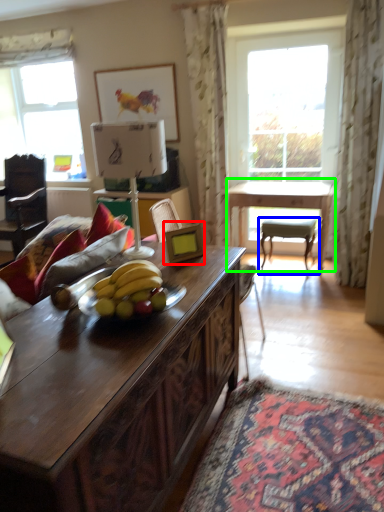
Question: Estimate the real-world distances between objects in this image. Which object is closer to picture frame (highlighted by a red box), chair (highlighted by a blue box) or table (highlighted by a green box)?

Choices:
 (A) chair
 (B) table

Answer: (B)